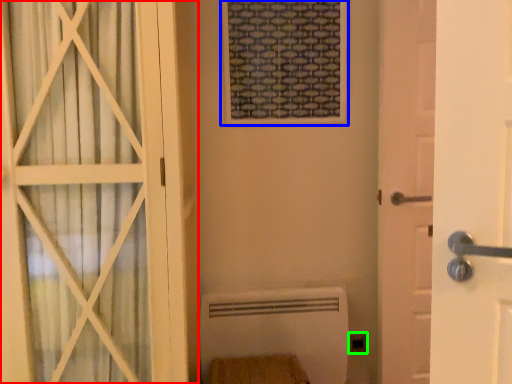
Question: Based on their relative distances, which object is nearer to door (highlighted by a red box)? Choose from window frame (highlighted by a blue box) and electric outlet (highlighted by a green box).

Choices:
 (A) window frame
 (B) electric outlet

Answer: (A)